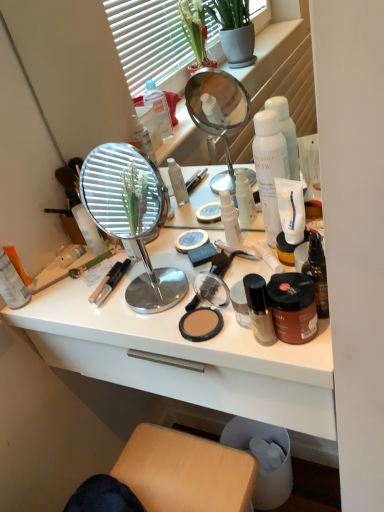
This screenshot has height=512, width=384. What are the coordinates of `vacant space in between orange matte lotion at left, positioned as the first toiletry in left-to-right order, and white matte pump bottle at center, which appears as the 4th toiletry when viewed from the right` in the screenshot? It's located at (109, 279).